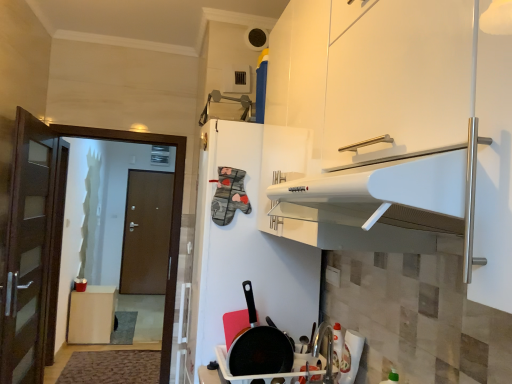
What is the approximate width of white glossy sink at lower center?

white glossy sink at lower center is 23.87 centimeters wide.

This screenshot has width=512, height=384. Describe the element at coordinates (319, 353) in the screenshot. I see `white glossy sink at lower center` at that location.

What is the approximate width of white glossy cabinet at upper center?

white glossy cabinet at upper center is 53.85 centimeters wide.

Measure the distance between point [266,241] and camera.

Point [266,241] is 6.52 feet from camera.

The height and width of the screenshot is (384, 512). Find the location of `white glossy sink at lower center`. white glossy sink at lower center is located at coordinates pyautogui.click(x=319, y=353).

Does point (326, 374) appear closer or farther from the camera than point (374, 89)?

Point (326, 374).

Does white glossy sink at lower center have a larger size compared to white glossy cabinet at upper center?

Incorrect, white glossy sink at lower center is not larger than white glossy cabinet at upper center.

From the image's perspective, is white glossy sink at lower center above or below white glossy cabinet at upper center?

white glossy sink at lower center is below white glossy cabinet at upper center.

Considering the sizes of objects white glossy sink at lower center and white glossy cabinet at upper center in the image provided, who is shorter, white glossy sink at lower center or white glossy cabinet at upper center?

white glossy cabinet at upper center is shorter.

Which is correct: brown wooden door at left is inside white glossy cabinet at upper center, or outside of it?

brown wooden door at left is outside white glossy cabinet at upper center.

How distant is brown wooden door at left from white glossy cabinet at upper center?

They are 7.20 feet apart.

Can you confirm if brown wooden door at left is wider than white glossy cabinet at upper center?

In fact, brown wooden door at left might be narrower than white glossy cabinet at upper center.

Which of these two, brown wooden door at left or white glossy cabinet at upper center, is bigger?

Bigger between the two is brown wooden door at left.

Is white matte refrigerator at center at the back of brown wooden door at left?

brown wooden door at left is not turned away from white matte refrigerator at center.

Which of these two, brown wooden door at left or white matte refrigerator at center, is thinner?

brown wooden door at left.

Which point is more forward, (167, 317) or (292, 310)?

The point (292, 310) is more forward.

From a real-world perspective, between brown matte door at left and white glossy sink at lower center, who is vertically lower?

From a 3D spatial view, brown matte door at left is below.

Is point (145, 188) less distant than point (313, 352)?

No, it is behind (313, 352).

How distant is brown matte door at left from white glossy sink at lower center?

brown matte door at left is 4.47 meters from white glossy sink at lower center.

In the scene shown: Is brown matte door at left wider or thinner than white glossy sink at lower center?

brown matte door at left is thinner than white glossy sink at lower center.

From a real-world perspective, which object rests below the other?

brown wooden door at left is physically lower.

Is white matte refrigerator at center in front of or behind brown wooden door at left in the image?

In the image, white matte refrigerator at center appears in front of brown wooden door at left.

Considering the sizes of white matte refrigerator at center and brown wooden door at left in the image, is white matte refrigerator at center taller or shorter than brown wooden door at left?

Considering their sizes, white matte refrigerator at center has less height than brown wooden door at left.

How far apart are white matte refrigerator at center and brown wooden door at left?

white matte refrigerator at center is 1.24 meters from brown wooden door at left.

Is white glossy sink at lower center positioned with its back to brown wooden door at left?

No.

Would you say white glossy sink at lower center is to the left or to the right of brown wooden door at left in the picture?

From the image, it's evident that white glossy sink at lower center is to the right of brown wooden door at left.

Considering the sizes of objects white glossy sink at lower center and brown wooden door at left in the image provided, who is thinner, white glossy sink at lower center or brown wooden door at left?

brown wooden door at left.

In terms of width, does brown matte door at left look wider or thinner when compared to brown wood trash can at left?

brown matte door at left is thinner than brown wood trash can at left.

Which is behind, brown matte door at left or brown wood trash can at left?

brown matte door at left is behind.

Who is shorter, brown matte door at left or brown wood trash can at left?

Standing shorter between the two is brown wood trash can at left.

This screenshot has width=512, height=384. In order to click on sink that is under the white glossy cabinet at upper center (from a real-world perspective) in this screenshot , I will do `click(319, 353)`.

Where is `screen door to the left of white glossy cabinet at upper center`? The width and height of the screenshot is (512, 384). screen door to the left of white glossy cabinet at upper center is located at coordinates (170, 217).

From the picture: Which object lies nearer to the anchor point white glossy sink at lower center, brown matte door at left or white matte refrigerator at center?

white matte refrigerator at center lies closer to white glossy sink at lower center than the other object.

Based on their spatial positions, is white matte refrigerator at center or non-stick black frying pan at lower center closer to white glossy cabinet at upper center?

white matte refrigerator at center lies closer to white glossy cabinet at upper center than the other object.

From the image, which object appears to be farther from white glossy sink at lower center, white glossy cabinet at upper center or non-stick black frying pan at lower center?

The object further to white glossy sink at lower center is white glossy cabinet at upper center.

When comparing their distances from brown wooden door at left, does white glossy cabinet at upper center or brown wood trash can at left seem closer?

brown wood trash can at left lies closer to brown wooden door at left than the other object.

Which object lies further to the anchor point brown matte door at left, brown wood trash can at left or white glossy sink at lower center?

white glossy sink at lower center is further to brown matte door at left.

Which object lies nearer to the anchor point white glossy cabinet at upper center, brown matte door at left or brown wooden door at left?

Among the two, brown wooden door at left is located nearer to white glossy cabinet at upper center.

From the image, which object appears to be farther from white glossy cabinet at upper center, white matte refrigerator at center or brown wood trash can at left?

brown wood trash can at left is positioned further to the anchor white glossy cabinet at upper center.

Based on their spatial positions, is white glossy cabinet at upper center or white matte refrigerator at center further from white glossy sink at lower center?

white glossy cabinet at upper center is positioned further to the anchor white glossy sink at lower center.

Image resolution: width=512 pixels, height=384 pixels. In order to click on fridge between white glossy sink at lower center and brown matte door at left along the z-axis in this screenshot , I will do `click(249, 239)`.

This screenshot has height=384, width=512. What are the coordinates of `screen door between non-stick black frying pan at lower center and brown matte door at left from front to back` in the screenshot? It's located at (170, 217).

This screenshot has height=384, width=512. I want to click on frying pan positioned between white glossy cabinet at upper center and brown wood trash can at left from near to far, so tap(259, 346).

Locate an element on the screen. This screenshot has width=512, height=384. screen door between white matte refrigerator at center and brown matte door at left in the front-back direction is located at coordinates (170, 217).